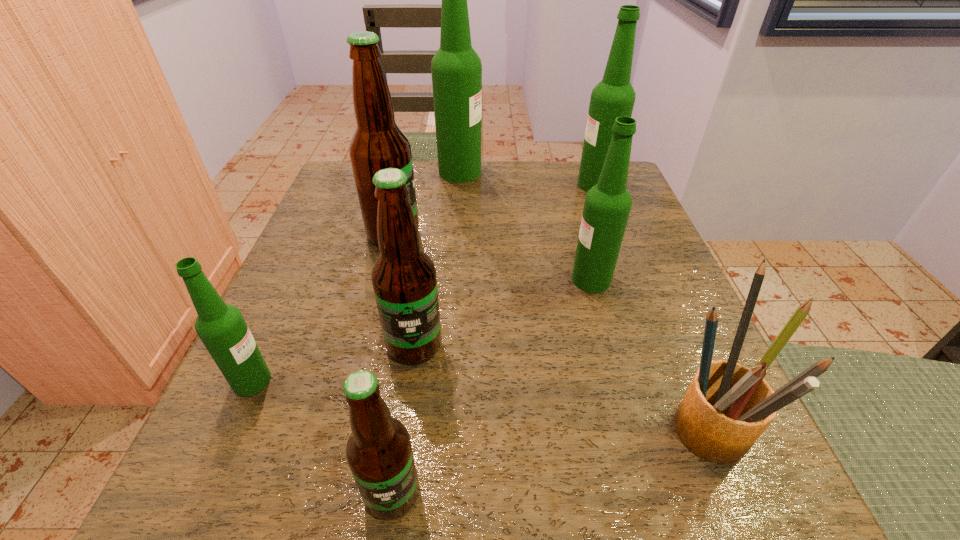
Where is `the leftmost beer bottle`? the leftmost beer bottle is located at coordinates coord(221,327).

At what (x,y) coordinates should I click in order to perform the action: click on the smallest brown beer bottle. Please return your answer as a coordinate pair (x, y). Image resolution: width=960 pixels, height=540 pixels. Looking at the image, I should click on (379, 453).

Image resolution: width=960 pixels, height=540 pixels. I want to click on the nearest beer bottle, so click(379, 453).

This screenshot has height=540, width=960. What are the coordinates of `free space located on the label of the tallest object` in the screenshot? It's located at (613, 172).

This screenshot has height=540, width=960. I want to click on vacant area situated on the label of the second biggest green beer bottle, so click(436, 185).

Locate an element on the screen. free space located 0.090m on the label of the second biggest green beer bottle is located at coordinates (540, 185).

The image size is (960, 540). What are the coordinates of `free region located on the label of the second biggest green beer bottle` in the screenshot? It's located at (415, 185).

At what (x,y) coordinates should I click in order to perform the action: click on free space located 0.340m on the label of the farthest brown beer bottle. Please return your answer as a coordinate pair (x, y). Looking at the image, I should click on (585, 234).

The image size is (960, 540). Identify the location of free space located on the label of the second nearest green beer bottle. (522, 280).

Identify the location of free region located on the label of the second nearest green beer bottle. (353, 280).